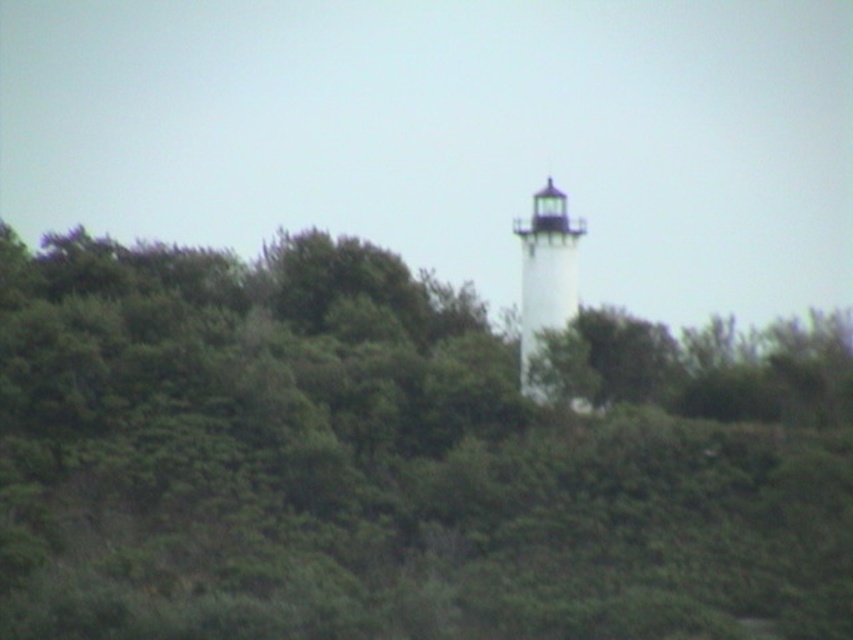
You are standing at the lighthouse and looking towards the dense greenery. There are two points marked in the image. Which point, point (560, 497) or point (556, 209), is closer to you?

Point (560, 497) is closer to you because it is in front of point (556, 209).

You are standing in the lighthouse area and want to see the top of the white painted wood lighthouse at center. Is there any obstruction from the green leafy tree at center?

The green leafy tree at center is below the white painted wood lighthouse at center, so it will not obstruct the view of the lighthouse top.